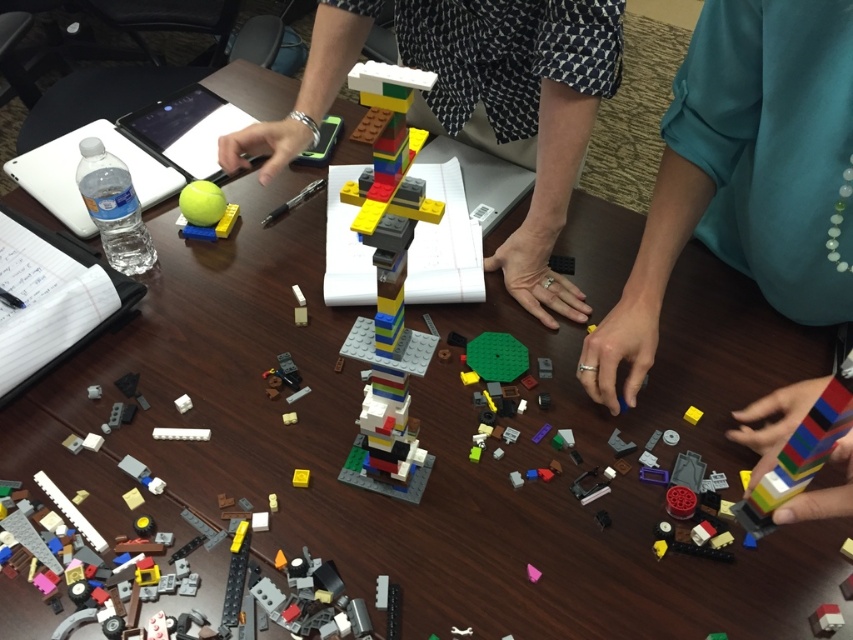
Is point (376, 108) less distant than point (219, 189)?

Yes, it is in front of point (219, 189).

Does point (383, 390) come farther from viewer compared to point (218, 214)?

That is False.

This screenshot has height=640, width=853. What are the coordinates of `multicolored plastic tower at center` in the screenshot? It's located at (387, 284).

The height and width of the screenshot is (640, 853). What are the coordinates of `multicolored plastic tower at center` in the screenshot? It's located at (387, 284).

Where is `teal fabric hand at center right`? This screenshot has width=853, height=640. teal fabric hand at center right is located at coordinates (743, 172).

From the picture: Is teal fabric hand at center right in front of multicolored plastic lego tower at center?

Yes, teal fabric hand at center right is closer to the viewer.

Describe the element at coordinates (743, 172) in the screenshot. I see `teal fabric hand at center right` at that location.

Where is `teal fabric hand at center right`? This screenshot has width=853, height=640. teal fabric hand at center right is located at coordinates (743, 172).

Is multicolored plastic lego tower at center wider than multicolored plastic tower at center?

Yes, multicolored plastic lego tower at center is wider than multicolored plastic tower at center.

Which of these two, multicolored plastic lego tower at center or multicolored plastic tower at center, stands taller?

multicolored plastic lego tower at center is taller.

In order to click on multicolored plastic lego tower at center in this screenshot , I will do `click(519, 108)`.